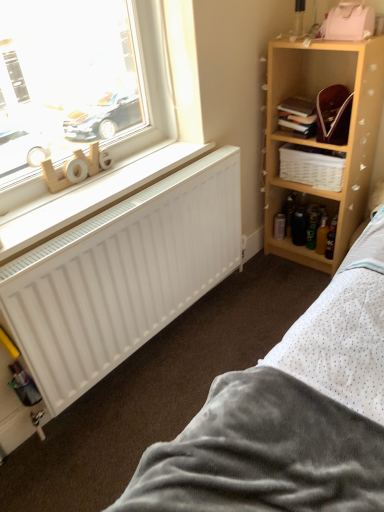
Locate an element on the screen. The height and width of the screenshot is (512, 384). free spot to the right of wooden letters at window is located at coordinates (124, 174).